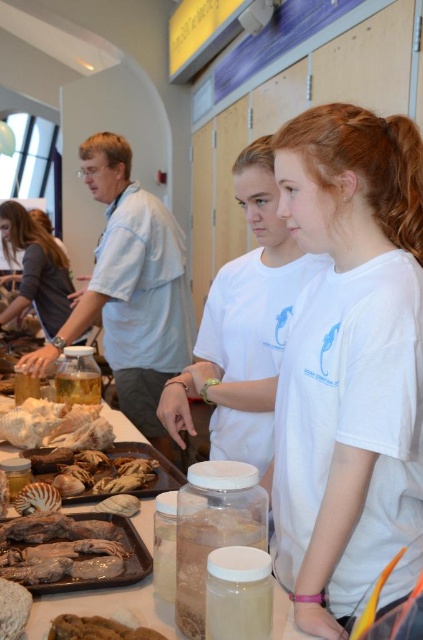
Which is below, translucent plastic tray at center or fuzzy brown bread at lower left?

translucent plastic tray at center is lower down.

Which is more to the right, translucent plastic tray at center or fuzzy brown bread at lower left?

translucent plastic tray at center

Between point (51, 612) and point (11, 584), which one is positioned behind?

The point (51, 612) is more distant.

Locate an element on the screen. This screenshot has height=640, width=423. translucent plastic tray at center is located at coordinates (104, 609).

Which is more to the left, white cotton t-shirt at center or fuzzy brown bread at lower left?

From the viewer's perspective, fuzzy brown bread at lower left appears more on the left side.

You are a GUI agent. You are given a task and a screenshot of the screen. Output one action in this format:
    pyautogui.click(x=<x>, y=<y>)
    Task: Click on the white cotton t-shirt at center
    The height and width of the screenshot is (640, 423).
    Given the screenshot: What is the action you would take?
    pyautogui.click(x=348, y=358)

In order to click on white cotton t-shirt at center in this screenshot , I will do `click(348, 358)`.

Is white cotton t-shirt at center positioned in front of brown crumbly bread at lower left?

No, it is not.

Image resolution: width=423 pixels, height=640 pixels. What do you see at coordinates (348, 358) in the screenshot?
I see `white cotton t-shirt at center` at bounding box center [348, 358].

Identify the location of white cotton t-shirt at center. (348, 358).